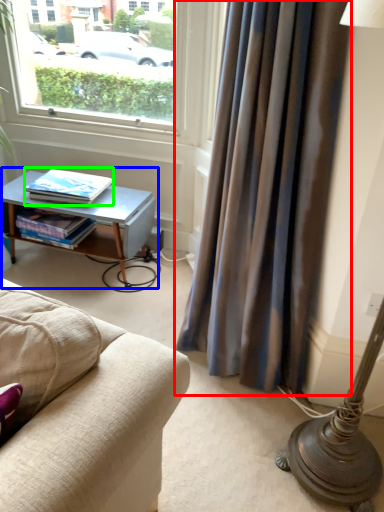
Question: Which object is the farthest from curtain (highlighted by a red box)? Choose among these: table (highlighted by a blue box) or book (highlighted by a green box).

Choices:
 (A) table
 (B) book

Answer: (B)